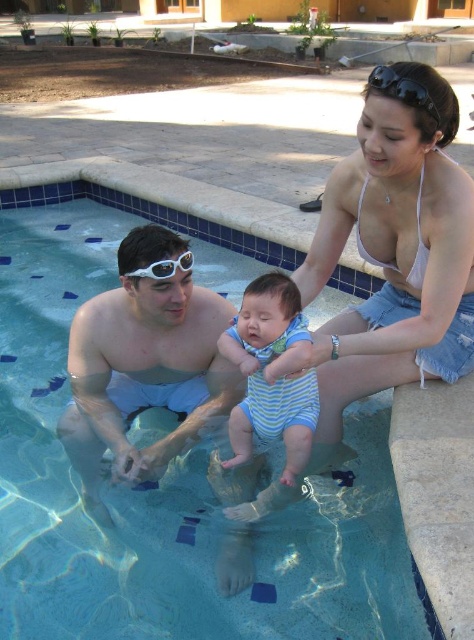
Question: Can you confirm if white plastic goggles at center is wider than blue tile swimming pool at center?

Choices:
 (A) no
 (B) yes

Answer: (A)

Question: Is the position of striped cotton onesie at center less distant than that of white matte goggles at upper center?

Choices:
 (A) yes
 (B) no

Answer: (A)

Question: Which object appears closest to the camera in this image?

Choices:
 (A) white matte goggles at upper center
 (B) blue tile swimming pool at center

Answer: (A)

Question: Can you confirm if striped cotton onesie at center is positioned above black plastic goggles at upper right?

Choices:
 (A) yes
 (B) no

Answer: (B)

Question: Which point appears farthest from the camera in this image?

Choices:
 (A) coord(146,266)
 (B) coord(273,332)
 (C) coord(426,106)

Answer: (A)

Question: Which object is positioned farthest from the black plastic goggles at upper right?

Choices:
 (A) white matte goggles at upper center
 (B) white plastic goggles at center
 (C) blue tile swimming pool at center

Answer: (C)